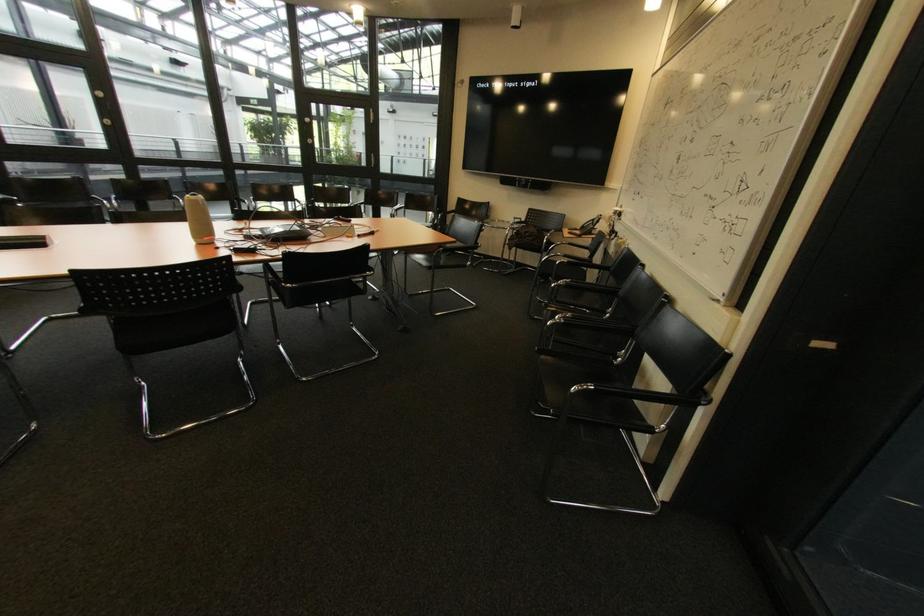
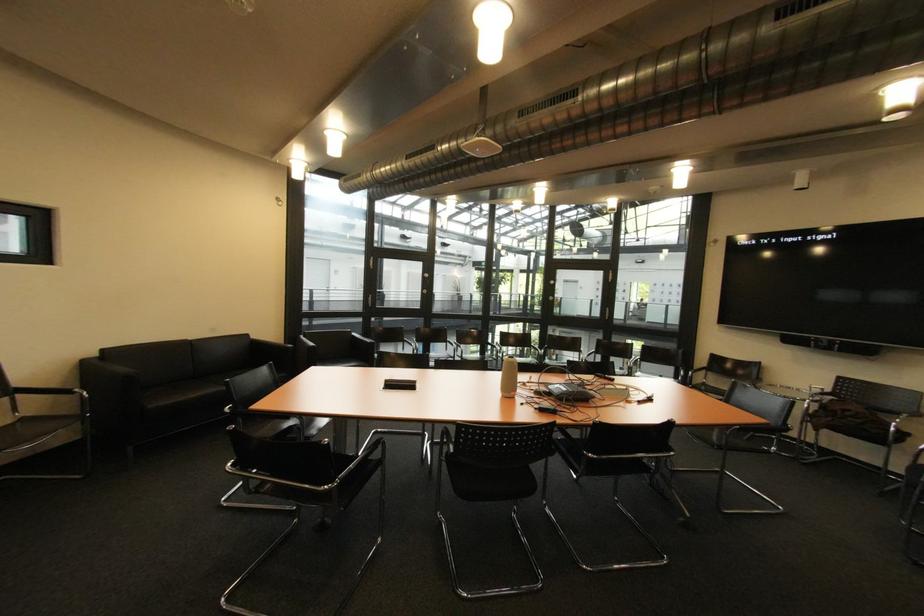
How did the camera likely rotate?

The camera rotated toward left-up.